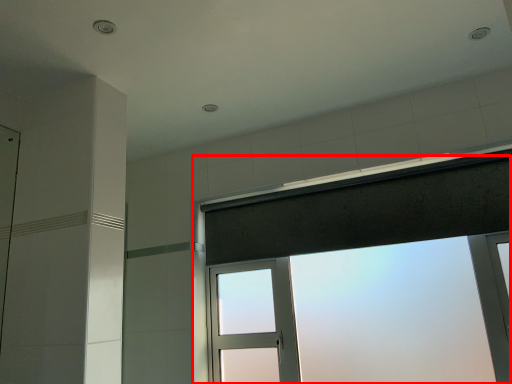
Question: From the image's perspective, where is window (annotated by the red box) located relative to shower curtain?

Choices:
 (A) above
 (B) below

Answer: (B)